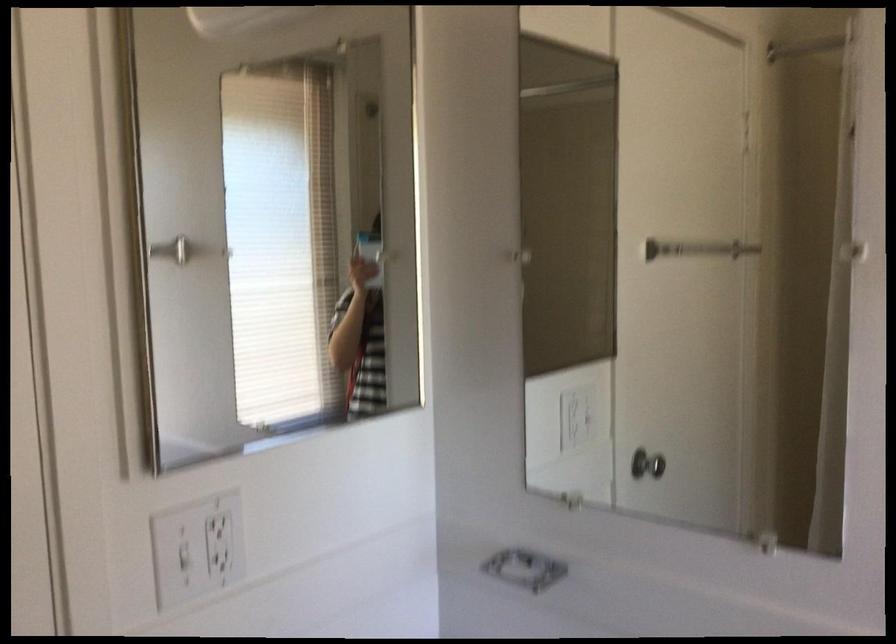
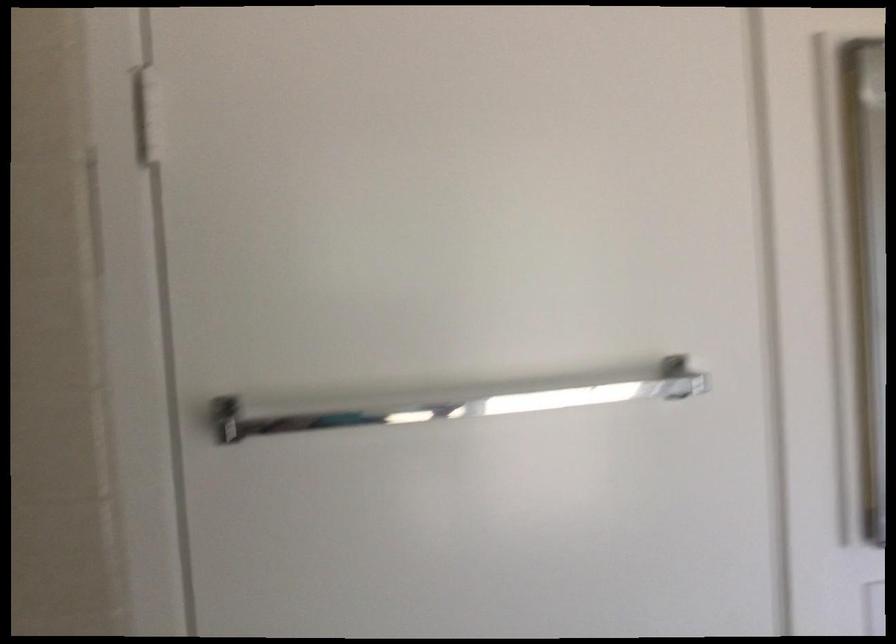
Question: Based on the continuous images, in which direction is the camera rotating? Reply with the corresponding letter.

Choices:
 (A) Left
 (B) Right
 (C) Up
 (D) Down

Answer: (A)